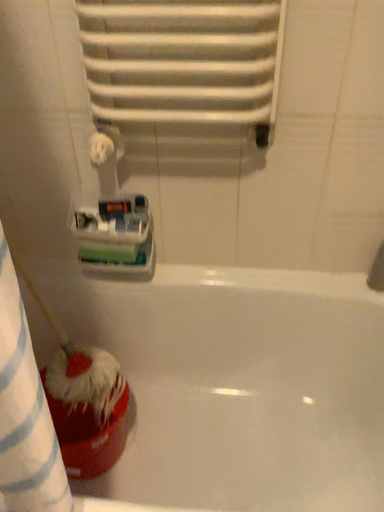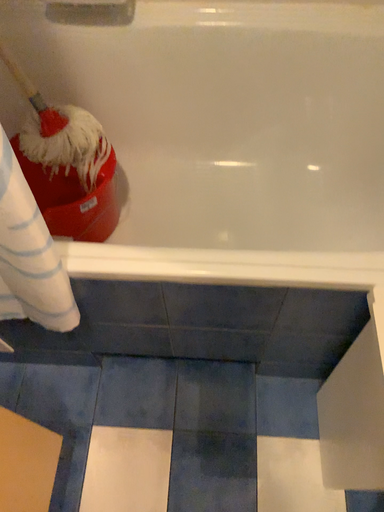
Question: Which way did the camera rotate in the video?

Choices:
 (A) rotated upward
 (B) rotated downward

Answer: (B)